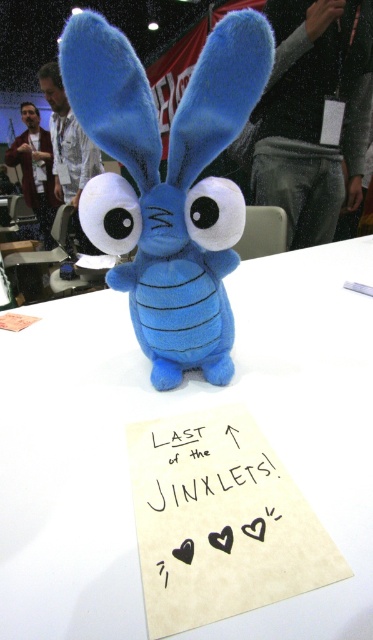
Question: Does white matte table at center appear under black paper at center?

Choices:
 (A) yes
 (B) no

Answer: (B)

Question: Which of the following is the closest to the observer?

Choices:
 (A) white matte table at center
 (B) black paper at center

Answer: (A)

Question: Can you confirm if white matte table at center is positioned above matte blue plush toy at center?

Choices:
 (A) no
 (B) yes

Answer: (A)

Question: Is white matte table at center positioned before black paper at center?

Choices:
 (A) yes
 (B) no

Answer: (A)

Question: Based on their relative distances, which object is farther from the white matte table at center?

Choices:
 (A) matte blue plush toy at center
 (B) black paper at center

Answer: (A)

Question: Estimate the real-world distances between objects in this image. Which object is farther from the white matte table at center?

Choices:
 (A) matte blue plush toy at center
 (B) black paper at center

Answer: (A)